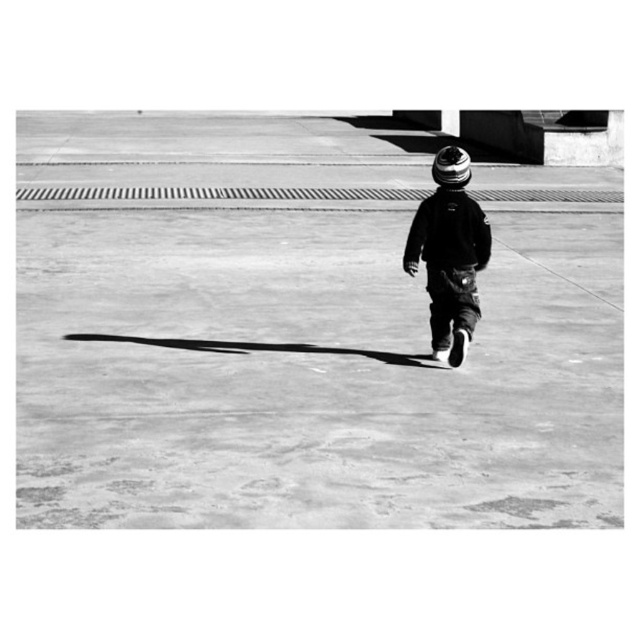
Question: Which of the following is the closest to the observer?

Choices:
 (A) smooth concrete pavement at center
 (B) textured woolen hat at center

Answer: (A)

Question: Which object appears closest to the camera in this image?

Choices:
 (A) textured woolen hat at center
 (B) striped knit hat at center

Answer: (A)

Question: Can you confirm if striped knit hat at center is positioned to the right of textured woolen hat at center?

Choices:
 (A) no
 (B) yes

Answer: (B)

Question: Is smooth concrete pavement at center above textured woolen hat at center?

Choices:
 (A) no
 (B) yes

Answer: (A)

Question: Does striped knit hat at center have a greater width compared to textured woolen hat at center?

Choices:
 (A) no
 (B) yes

Answer: (B)

Question: Among these points, which one is nearest to the camera?

Choices:
 (A) (468, 168)
 (B) (449, 172)
 (C) (260, 328)

Answer: (B)